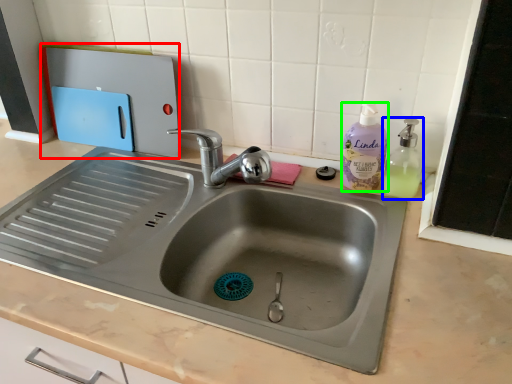
Question: Based on their relative distances, which object is nearer to appliance (highlighted by a red box)? Choose from soap dispenser (highlighted by a blue box) and cleaning product (highlighted by a green box).

Choices:
 (A) soap dispenser
 (B) cleaning product

Answer: (B)